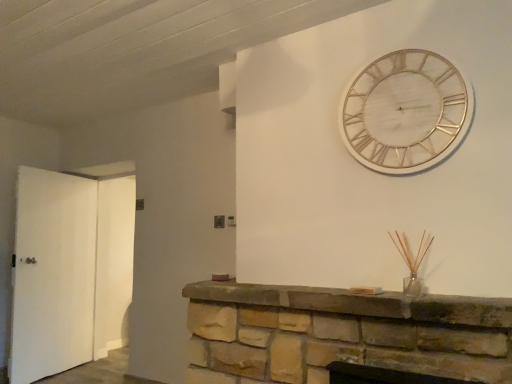
Question: From a real-world perspective, is brown stone fireplace at center positioned above or below white matte door at left, arranged as the second door when viewed from the left?

Choices:
 (A) below
 (B) above

Answer: (A)

Question: In the image, is brown stone fireplace at center positioned in front of or behind white matte door at left, acting as the 1th door starting from the right?

Choices:
 (A) behind
 (B) front

Answer: (B)

Question: Estimate the real-world distances between objects in this image. Which object is farther from the white wood wall clock at upper right?

Choices:
 (A) white matte door at left, which is the second door from right to left
 (B) brown stone fireplace at center
 (C) white matte door at left, acting as the 1th door starting from the right

Answer: (C)

Question: Which object is the closest to the white matte door at left, acting as the 1th door starting from the right?

Choices:
 (A) white wood wall clock at upper right
 (B) brown stone fireplace at center
 (C) white matte door at left, which is counted as the 1th door, starting from the left

Answer: (C)